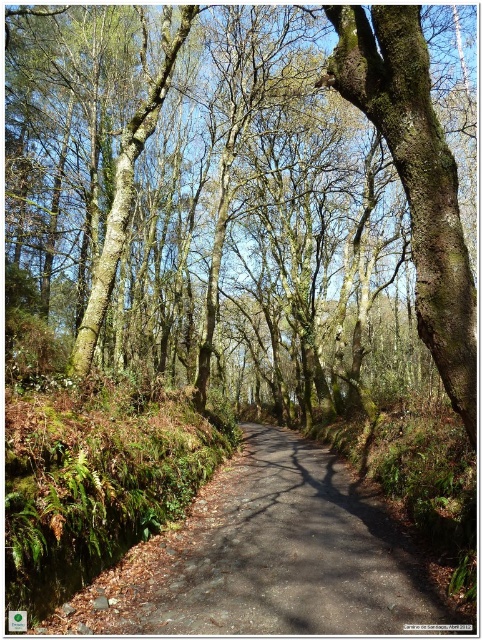
Between point (294, 61) and point (279, 445), which one is positioned in front?

Positioned in front is point (279, 445).

Which is in front, point (444, 285) or point (289, 449)?

Point (444, 285)

The height and width of the screenshot is (640, 482). Find the location of `rough bark tree at center`. rough bark tree at center is located at coordinates (233, 188).

Which is in front, point (133, 173) or point (443, 365)?

Point (443, 365) is in front.

Where is `rough bark tree at center`? rough bark tree at center is located at coordinates (233, 188).

Is dark gray asphalt road at center to the left of green mossy bark tree at center from the viewer's perspective?

Indeed, dark gray asphalt road at center is positioned on the left side of green mossy bark tree at center.

Is point (310, 442) positioned in front of point (326, 83)?

No, (310, 442) is further to viewer.

You are a GUI agent. You are given a task and a screenshot of the screen. Output one action in this format:
    pyautogui.click(x=<x>, y=<y>)
    Task: Click on the dark gray asphalt road at center
    Image resolution: width=482 pixels, height=640 pixels.
    Given the screenshot: What is the action you would take?
    pyautogui.click(x=290, y=554)